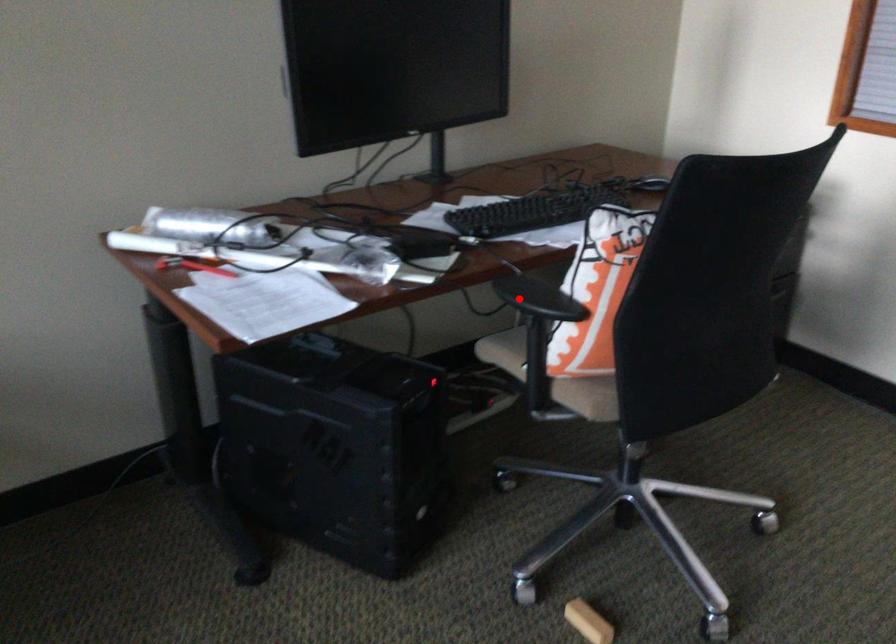
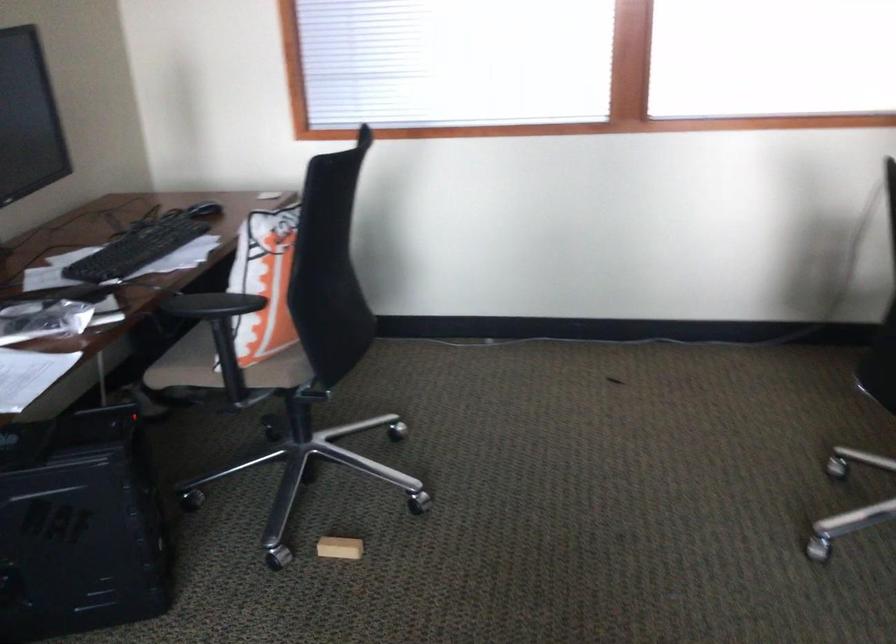
Question: I am providing you with two images of the same scene from different viewpoints. Image1 has a red point marked. In image2, the corresponding 3D location appears at what relative position? Reply with the corresponding letter.

Choices:
 (A) Closer
 (B) Farther

Answer: (B)